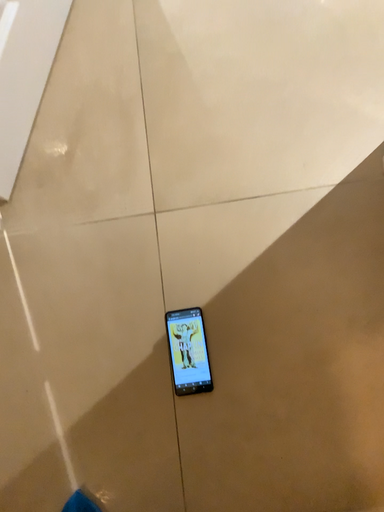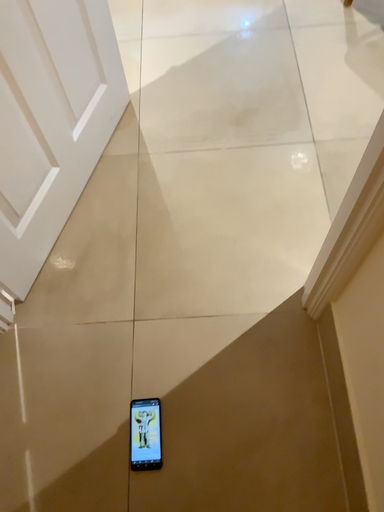
Question: Which way did the camera rotate in the video?

Choices:
 (A) rotated downward
 (B) rotated upward

Answer: (B)